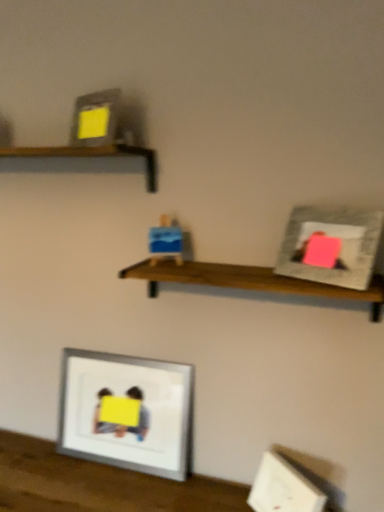
Question: Does wooden shelf at upper left, positioned as the second shelf in right-to-left order, lie behind blue cardboard box at center?

Choices:
 (A) yes
 (B) no

Answer: (B)

Question: Is wooden shelf at upper left, the first shelf viewed from the top, closer to camera compared to blue cardboard box at center?

Choices:
 (A) yes
 (B) no

Answer: (A)

Question: Is wooden shelf at upper left, positioned as the second shelf in right-to-left order, looking in the opposite direction of blue cardboard box at center?

Choices:
 (A) no
 (B) yes

Answer: (A)

Question: Considering the relative sizes of wooden shelf at upper left, arranged as the second shelf when ordered from the bottom, and blue cardboard box at center in the image provided, is wooden shelf at upper left, arranged as the second shelf when ordered from the bottom, thinner than blue cardboard box at center?

Choices:
 (A) no
 (B) yes

Answer: (A)

Question: Does wooden shelf at upper left, positioned as the second shelf in right-to-left order, have a greater height compared to blue cardboard box at center?

Choices:
 (A) yes
 (B) no

Answer: (B)

Question: From a real-world perspective, is wooden shelf at upper left, the first shelf viewed from the top, beneath blue cardboard box at center?

Choices:
 (A) no
 (B) yes

Answer: (A)

Question: Considering the relative positions of wooden shelf at center, the first shelf positioned from the bottom, and silver metallic picture frame at lower center, acting as the first picture frame starting from the left, in the image provided, is wooden shelf at center, the first shelf positioned from the bottom, to the left of silver metallic picture frame at lower center, acting as the first picture frame starting from the left, from the viewer's perspective?

Choices:
 (A) no
 (B) yes

Answer: (A)

Question: Can you confirm if wooden shelf at center, which is counted as the first shelf, starting from the right, is bigger than silver metallic picture frame at lower center, placed as the second picture frame when sorted from front to back?

Choices:
 (A) no
 (B) yes

Answer: (B)

Question: Can silver metallic picture frame at lower center, placed as the second picture frame when sorted from front to back, be found inside wooden shelf at center, which is the 2th shelf in top-to-bottom order?

Choices:
 (A) yes
 (B) no

Answer: (B)

Question: Is wooden shelf at center, which is counted as the first shelf, starting from the right, smaller than silver metallic picture frame at lower center, acting as the first picture frame starting from the left?

Choices:
 (A) yes
 (B) no

Answer: (B)

Question: Is wooden shelf at center, which is the 2th shelf in top-to-bottom order, taller than silver metallic picture frame at lower center, acting as the first picture frame starting from the left?

Choices:
 (A) yes
 (B) no

Answer: (B)

Question: From the image's perspective, is wooden shelf at center, the first shelf positioned from the bottom, beneath silver metallic picture frame at lower center, acting as the 2th picture frame starting from the top?

Choices:
 (A) no
 (B) yes

Answer: (A)

Question: Is matte gray picture frame at upper right, the first picture frame from the front, positioned with its back to wooden shelf at center, which is the 2th shelf in left-to-right order?

Choices:
 (A) no
 (B) yes

Answer: (A)